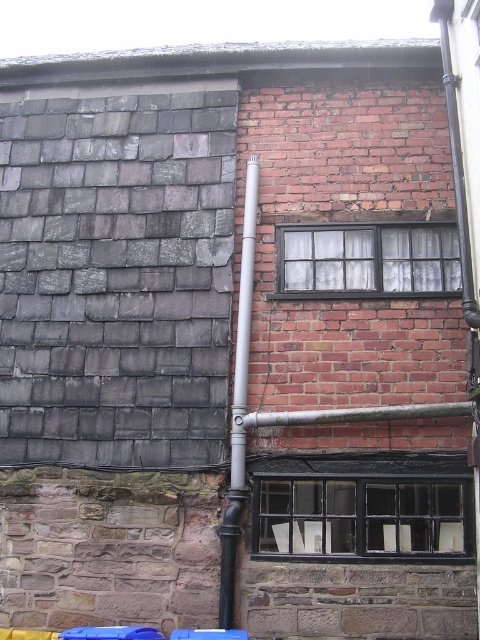
Question: Which of these objects is positioned closest to the black painted wood window at lower center?

Choices:
 (A) silver metallic pipe at center
 (B) matte black window at center

Answer: (A)

Question: Considering the relative positions of black painted wood window at lower center and matte black window at center in the image provided, where is black painted wood window at lower center located with respect to matte black window at center?

Choices:
 (A) above
 (B) below

Answer: (B)

Question: Does matte black window at center come in front of silver metallic pipe at center?

Choices:
 (A) no
 (B) yes

Answer: (A)

Question: Which point is closer to the camera?

Choices:
 (A) silver metallic pipe at center
 (B) black painted wood window at lower center

Answer: (A)

Question: Which point is farther to the camera?

Choices:
 (A) (236, 333)
 (B) (455, 243)
 (C) (435, 545)

Answer: (B)

Question: Can you confirm if black painted wood window at lower center is smaller than silver metallic pipe at center?

Choices:
 (A) yes
 (B) no

Answer: (B)